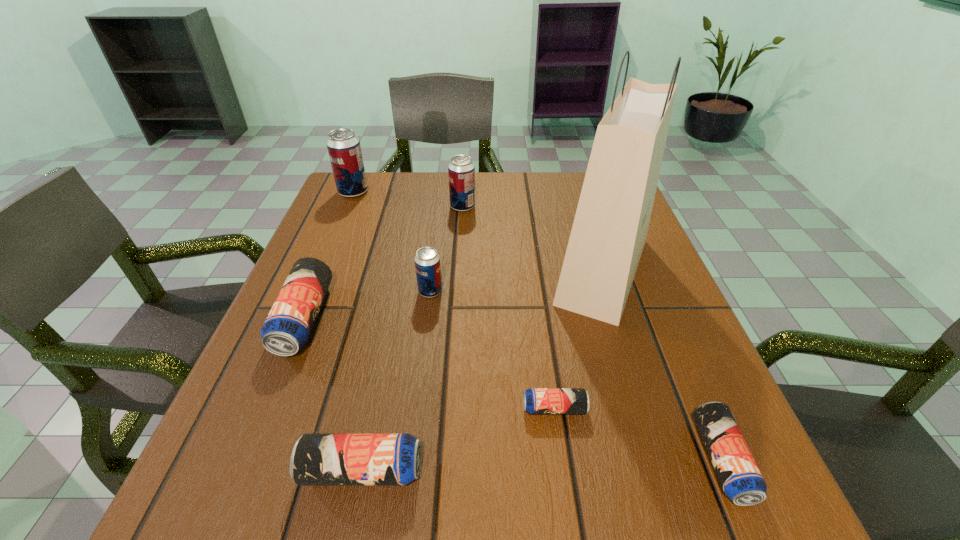
Locate an element on the screen. the second blue beer can from left to right is located at coordinates pyautogui.click(x=317, y=459).

The height and width of the screenshot is (540, 960). In order to click on the third biggest blue beer can in this screenshot , I will do `click(741, 480)`.

You are a GUI agent. You are given a task and a screenshot of the screen. Output one action in this format:
    pyautogui.click(x=<x>, y=<y>)
    Task: Click on the rightmost blue beer can
    This screenshot has height=540, width=960.
    Given the screenshot: What is the action you would take?
    pyautogui.click(x=741, y=480)

Find the location of a particular element. The width and height of the screenshot is (960, 540). the smallest blue beer can is located at coordinates (535, 400).

The width and height of the screenshot is (960, 540). What are the coordinates of `the shortest beer can` in the screenshot? It's located at (535, 400).

Locate an element on the screen. This screenshot has height=540, width=960. vacant space located on the left of the shopping bag is located at coordinates (518, 271).

Locate an element on the screen. free space located on the front of the seventh shortest object is located at coordinates (315, 282).

Where is `free space located on the right of the second farthest beer can`? free space located on the right of the second farthest beer can is located at coordinates (517, 207).

Identify the location of vacant position located on the left of the smallest red beer can. (296, 291).

Locate an element on the screen. The height and width of the screenshot is (540, 960). vacant space located on the front of the leftmost blue beer can is located at coordinates (261, 422).